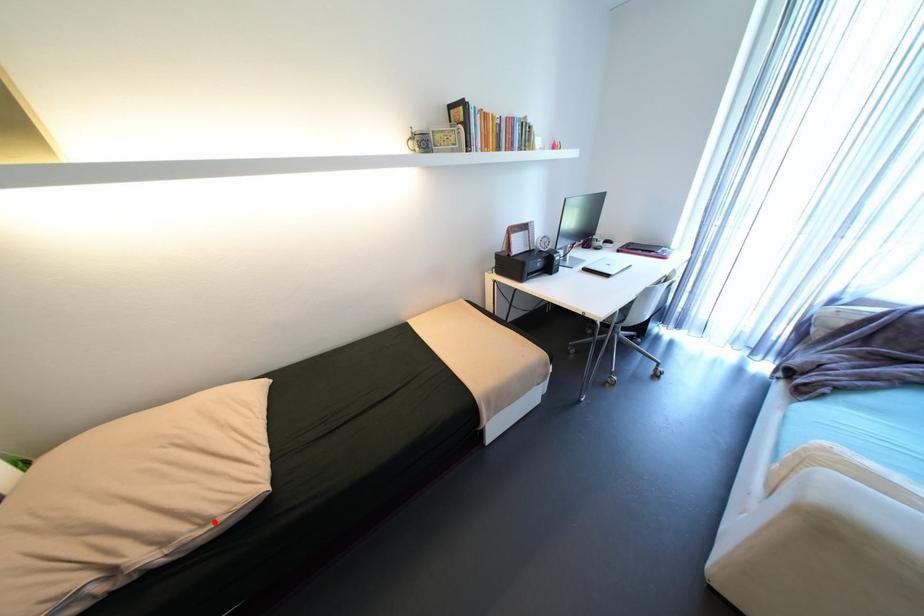
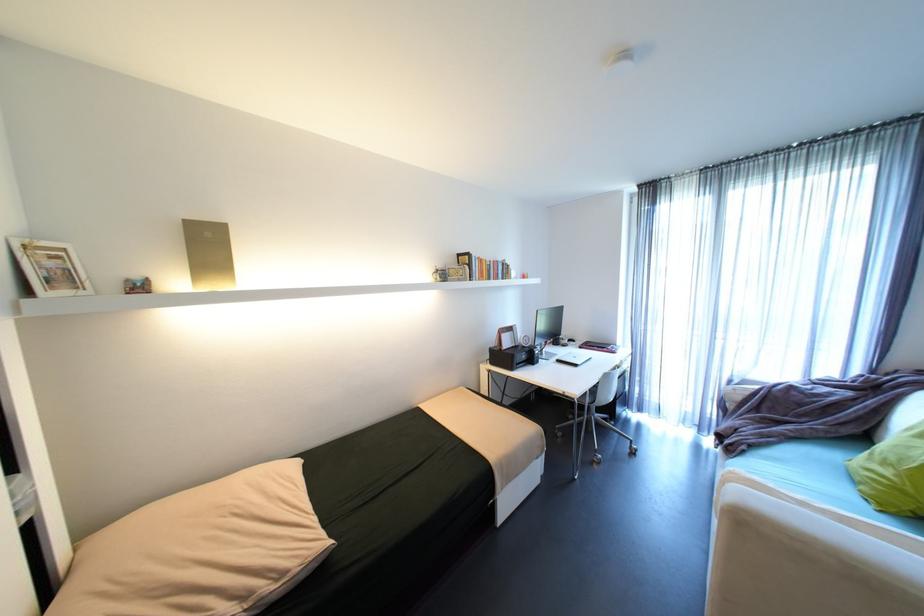
The point at the highlighted location is marked in the first image. Where is the corresponding point in the second image?

(289, 575)